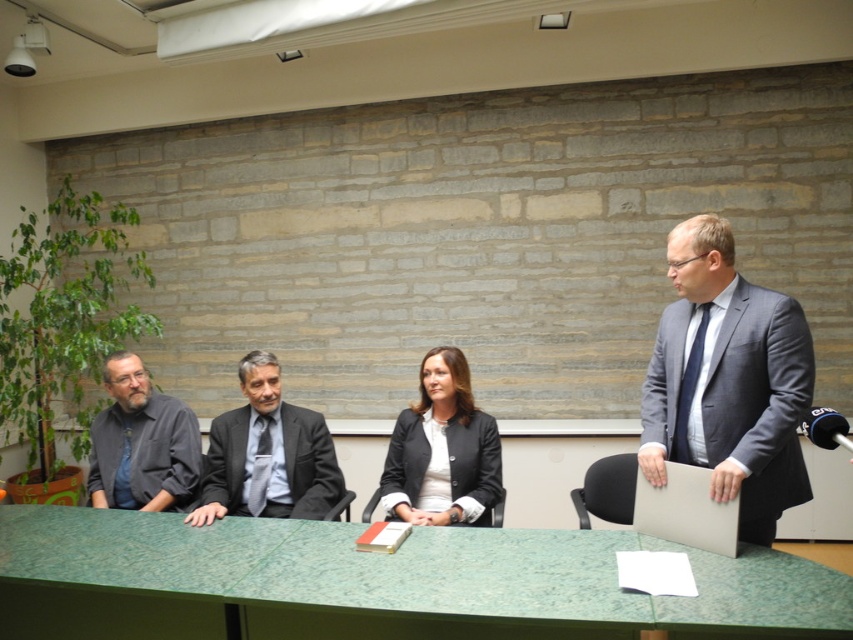
Question: Which of the following is the farthest from the observer?

Choices:
 (A) matte black blazer at center
 (B) dark gray shirt at left
 (C) gray suit at right

Answer: (B)

Question: Can you confirm if gray suit at right is positioned to the left of dark gray shirt at left?

Choices:
 (A) no
 (B) yes

Answer: (A)

Question: Among these points, which one is farthest from the camera?

Choices:
 (A) (675, 509)
 (B) (119, 442)
 (C) (463, 426)

Answer: (B)

Question: Among these points, which one is farthest from the camera?

Choices:
 (A) (347, 552)
 (B) (115, 502)
 (C) (717, 504)

Answer: (B)

Question: Does matte black blazer at center have a lesser width compared to dark gray shirt at left?

Choices:
 (A) no
 (B) yes

Answer: (B)

Question: Where is gray suit at right located in relation to dark gray shirt at left in the image?

Choices:
 (A) right
 (B) left

Answer: (A)